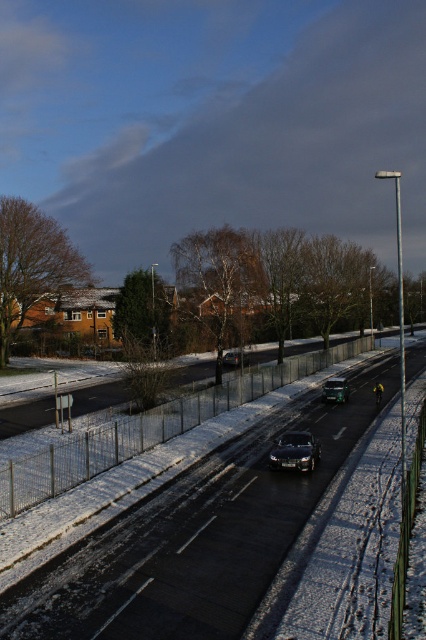
Which is below, metallic silver car at center or shiny black sedan at center?

metallic silver car at center is lower down.

Is point (344, 397) farther from viewer compared to point (247, 358)?

No, it is not.

Between point (345, 396) and point (235, 355), which one is positioned behind?

The point (235, 355) is more distant.

You are a GUI agent. You are given a task and a screenshot of the screen. Output one action in this format:
    pyautogui.click(x=<x>, y=<y>)
    Task: Click on the metallic silver car at center
    This screenshot has height=640, width=426.
    Given the screenshot: What is the action you would take?
    pyautogui.click(x=336, y=388)

Does black asphalt road at center appear under shiny black sedan at center?

Correct, black asphalt road at center is located below shiny black sedan at center.

Which is more to the right, black asphalt road at center or shiny black sedan at center?

shiny black sedan at center is more to the right.

Which is behind, point (155, 547) or point (229, 358)?

The point (229, 358) is more distant.

The height and width of the screenshot is (640, 426). Identify the location of black asphalt road at center. (196, 536).

Does black asphalt road at center have a greater width compared to shiny black car at center?

Correct, the width of black asphalt road at center exceeds that of shiny black car at center.

Between point (238, 461) and point (285, 464), which one is positioned in front?

Point (285, 464) is more forward.

Between point (112, 564) and point (308, 433), which one is positioned behind?

The point (308, 433) is behind.

The height and width of the screenshot is (640, 426). What are the coordinates of `black asphalt road at center` in the screenshot? It's located at (196, 536).